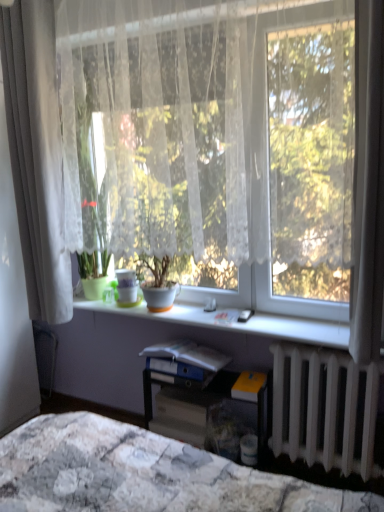
Question: In the image, is yellow matte paperback book at lower right, acting as the second paperback book starting from the top, positioned in front of or behind white sheer curtain at left?

Choices:
 (A) front
 (B) behind

Answer: (B)

Question: Is yellow matte paperback book at lower right, marked as the 2th paperback book in a bottom-to-top arrangement, wider or thinner than white sheer curtain at left?

Choices:
 (A) wide
 (B) thin

Answer: (A)

Question: Estimate the real-world distances between objects in this image. Which object is farther from the matte plastic desk at center?

Choices:
 (A) blue matte folder at center, which appears as the 3th paperback book when ordered from the bottom
 (B) white lace curtain at center
 (C) white glossy window sill at center
 (D) white sheer curtain at left
 (E) matte gray paperback book at center, the 3th paperback book in the top-to-bottom sequence

Answer: (D)

Question: Considering the real-world distances, which object is farthest from the green matte pot at center, the 1th houseplant in the left-to-right sequence?

Choices:
 (A) matte plastic desk at center
 (B) matte white pot at center, which is counted as the 2th houseplant, starting from the left
 (C) white lace curtain at center
 (D) white metallic radiator at lower right
 (E) white sheer curtain at left

Answer: (D)